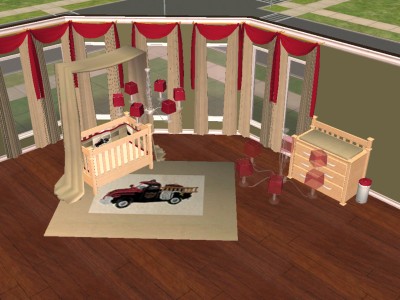
Locate an element on the screen. drawers is located at coordinates (340, 166), (337, 178), (337, 195).